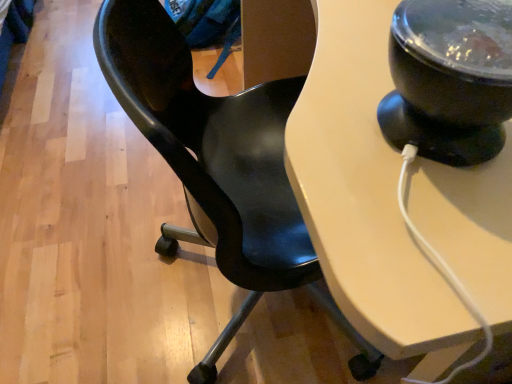
Image resolution: width=512 pixels, height=384 pixels. Identify the location of free location to the left of black plastic chair at center. (91, 257).